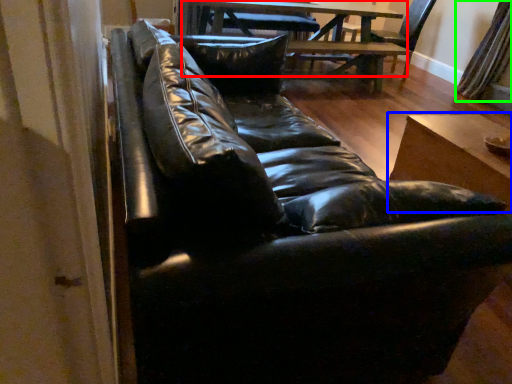
Question: Which object is positioned farthest from table (highlighted by a red box)? Select from table (highlighted by a blue box) and curtain (highlighted by a green box).

Choices:
 (A) table
 (B) curtain

Answer: (A)